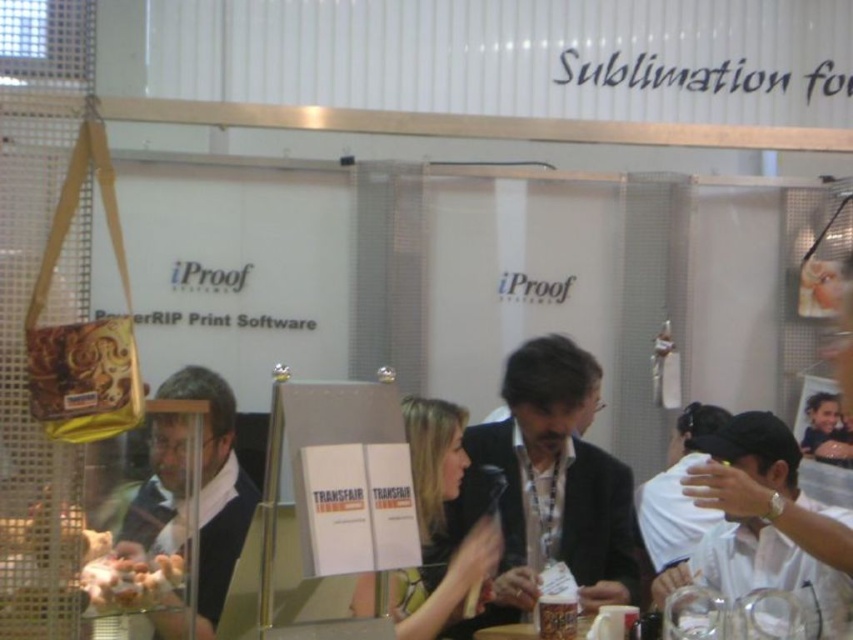
Question: Which point is closer to the camera?

Choices:
 (A) (570, 493)
 (B) (102, 611)
 (C) (799, 508)

Answer: (B)

Question: Which object is farther from the camera taking this photo?

Choices:
 (A) white fabric cap at upper right
 (B) golden crispy chicken at lower left

Answer: (A)

Question: Is white fabric cap at upper right wider than golden crispy chicken at lower left?

Choices:
 (A) yes
 (B) no

Answer: (A)

Question: Which object is the farthest from the golden crispy chicken at lower left?

Choices:
 (A) white fabric cap at upper right
 (B) matte black suit at center
 (C) matte black sweater at center
 (D) black fabric jacket at center

Answer: (A)

Question: Observing the image, what is the correct spatial positioning of white fabric cap at upper right in reference to matte black sweater at center?

Choices:
 (A) left
 (B) right

Answer: (B)

Question: Is black fabric jacket at center above golden crispy chicken at lower left?

Choices:
 (A) no
 (B) yes

Answer: (A)